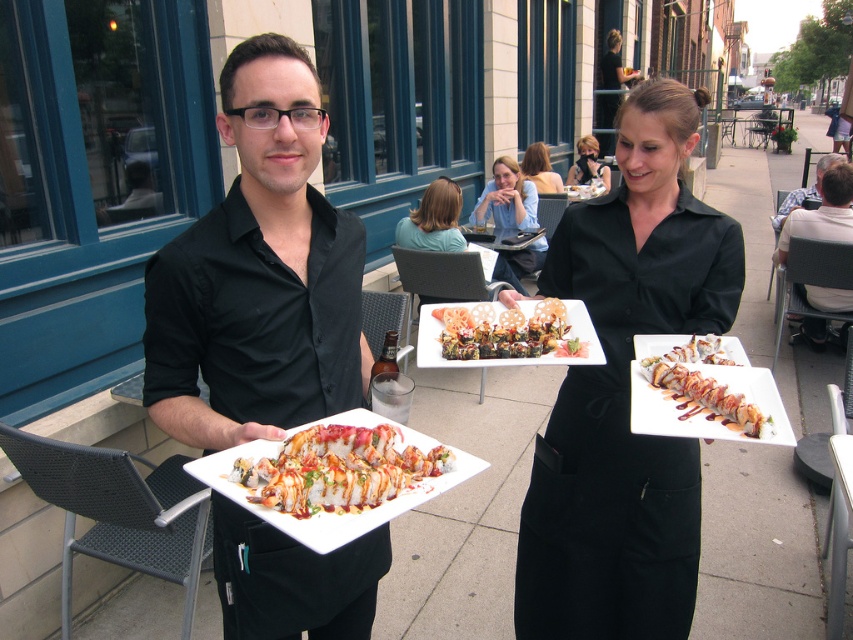
Question: Which object is closer to the camera taking this photo?

Choices:
 (A) gray fabric chair at right
 (B) blonde hair at upper center

Answer: (A)

Question: Which of the following is the closest to the observer?

Choices:
 (A) (199, 464)
 (B) (846, 168)
 (C) (534, 182)

Answer: (A)

Question: Can you confirm if smokey brown glazed sushi at center is bigger than matte black dress at upper center?

Choices:
 (A) yes
 (B) no

Answer: (B)

Question: Does sleek white plate at center appear on the left side of gray fabric chair at right?

Choices:
 (A) no
 (B) yes

Answer: (B)

Question: Among these objects, which one is nearest to the camera?

Choices:
 (A) smokey brown glazed sushi at center
 (B) sleek white plate at center
 (C) black matte uniform at center
 (D) matte black dress at upper center

Answer: (B)

Question: Is slightly glossy wooden skewers at center thinner than matte black dress at upper center?

Choices:
 (A) no
 (B) yes

Answer: (B)